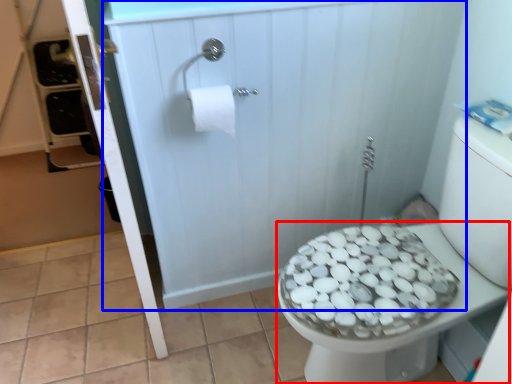
Question: Which object is further to the camera taking this photo, bidet (highlighted by a red box) or screen door (highlighted by a blue box)?

Choices:
 (A) bidet
 (B) screen door

Answer: (B)